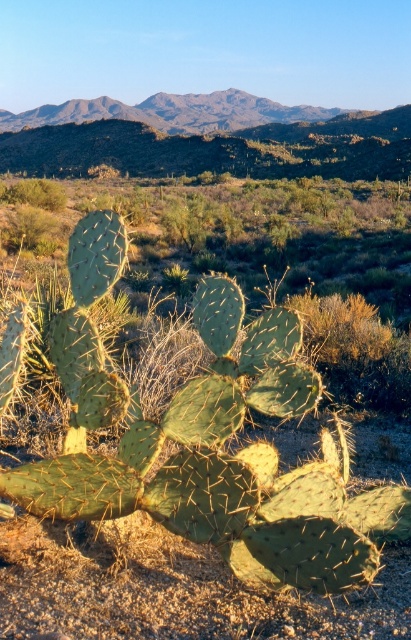
Question: Is green spiny cactus at center wider than rugged brown mountain at upper center?

Choices:
 (A) no
 (B) yes

Answer: (A)

Question: Which point is closer to the camera?

Choices:
 (A) (212, 492)
 (B) (226, 113)

Answer: (A)

Question: Is green spiny cactus at center positioned behind rugged brown mountain at upper center?

Choices:
 (A) yes
 (B) no

Answer: (B)

Question: Is green spiny cactus at center bigger than rugged brown mountain at upper center?

Choices:
 (A) yes
 (B) no

Answer: (B)